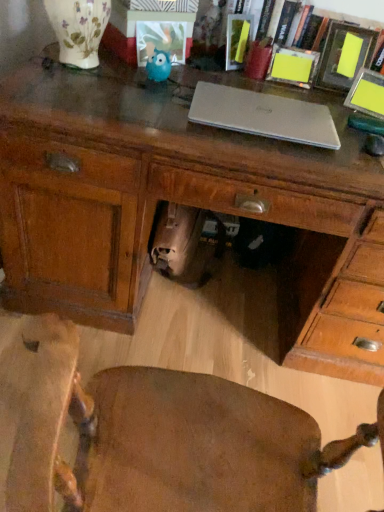
Locate an element on the screen. This screenshot has height=512, width=384. vacant space that is to the left of matte yellow book at upper center, acting as the second book starting from the right is located at coordinates (202, 61).